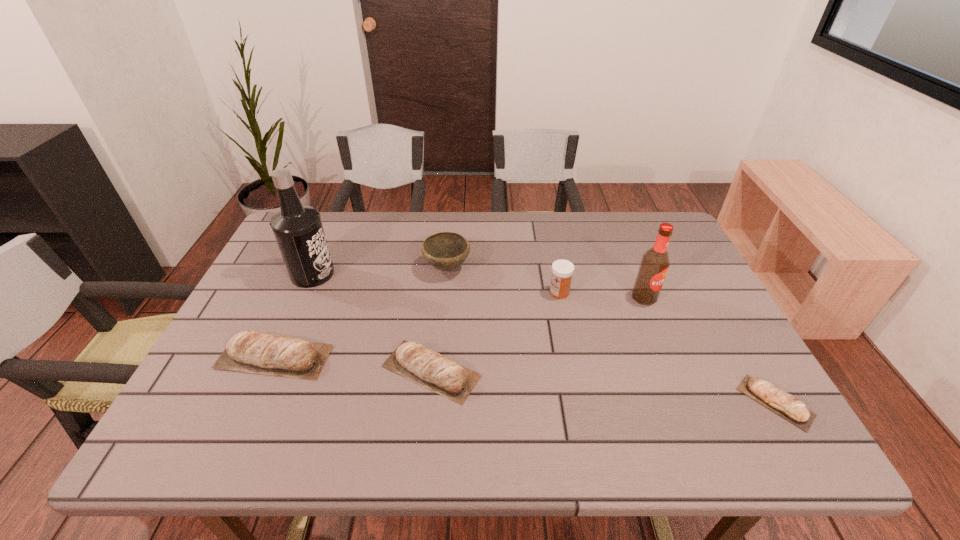
The height and width of the screenshot is (540, 960). I want to click on free space located 0.250m on the back of the leftmost pita bread, so click(313, 271).

Identify the location of vacant space located on the right of the sixth tallest object. This screenshot has width=960, height=540. (521, 371).

Find the location of a particular element. vacant space located 0.140m on the left of the rightmost pita bread is located at coordinates (677, 402).

This screenshot has height=540, width=960. Find the location of `vacant space located on the front of the bowl`. vacant space located on the front of the bowl is located at coordinates (440, 350).

This screenshot has width=960, height=540. I want to click on blank space located on the front label of the liquor, so click(x=440, y=274).

At what (x,y) coordinates should I click in order to perform the action: click on free space located 0.260m on the left of the fifth object from left to right. Please return your answer as a coordinate pair (x, y). The width and height of the screenshot is (960, 540). Looking at the image, I should click on (454, 292).

Image resolution: width=960 pixels, height=540 pixels. Identify the location of free space located 0.120m on the right of the second object from right to left. (701, 298).

The image size is (960, 540). What are the coordinates of `object positioned at the far edge` in the screenshot? It's located at (446, 251).

Where is `pita bread positioned at the left edge`? The height and width of the screenshot is (540, 960). pita bread positioned at the left edge is located at coordinates (270, 355).

Locate an element on the screen. The image size is (960, 540). liquor at the left edge is located at coordinates (298, 230).